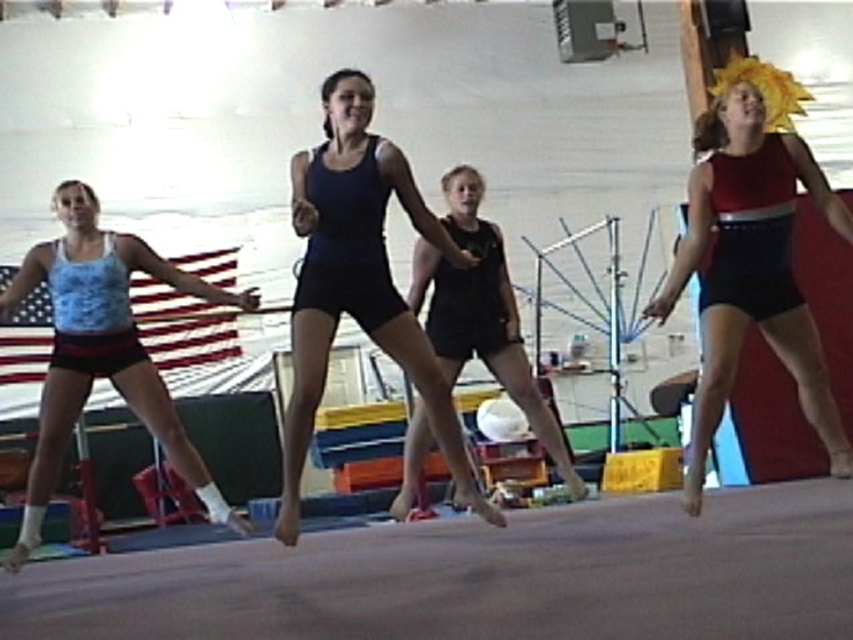
You are a photographer positioned at the front of the gymnasium. You need to capture a photo that includes both the matte red leotard at right and the black matte shorts at center. Which object should you focus on first to ensure both are in sharp focus?

You should focus on the matte red leotard at right first because it is closer to the viewer than the black matte shorts at center. By focusing on the closer object, the depth of field may still keep the farther object in acceptable focus.

You are a photographer setting up for a group photo in the gymnasium. You need to position yourself so that both the matte red leotard at right and the black matte shorts at center are in frame. Given that your camera has a 5 feet wide field of view, can you capture both objects without moving the camera?

The matte red leotard at right and the black matte shorts at center are 5.33 feet apart. Since the camera has a 5 feet wide field of view, which is narrower than the distance between them, you cannot capture both objects in the same frame without moving the camera.